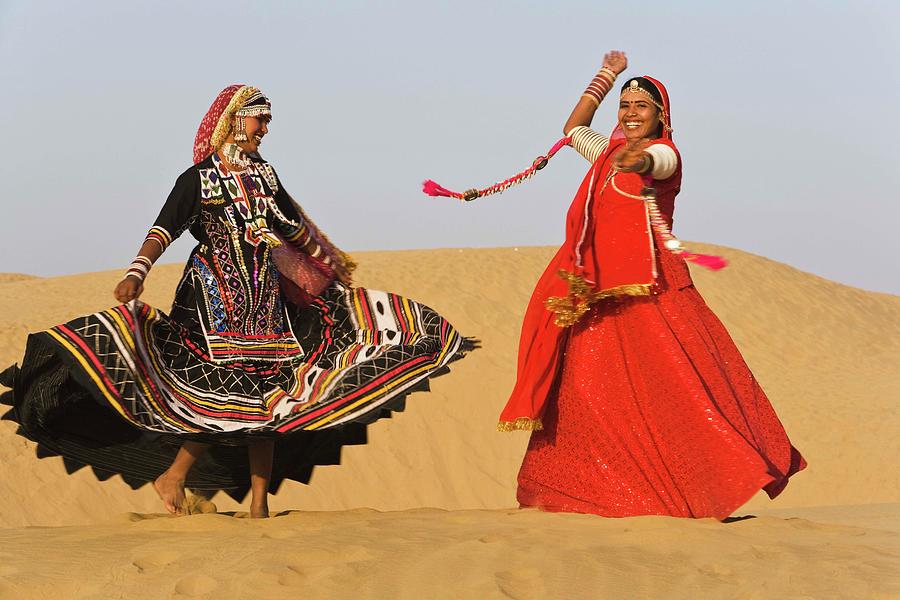
The width and height of the screenshot is (900, 600). What are the coordinates of `sash` in the screenshot? It's located at (271, 237).